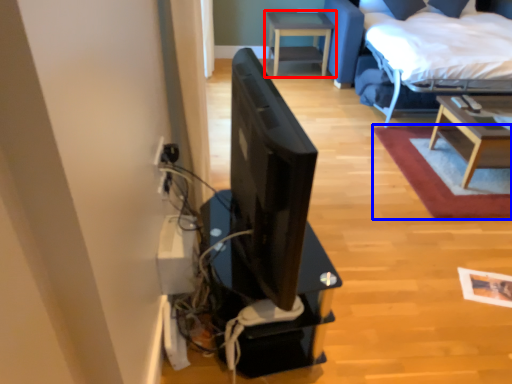
Question: Which object is further to the camera taking this photo, table (highlighted by a red box) or plain (highlighted by a blue box)?

Choices:
 (A) table
 (B) plain

Answer: (A)